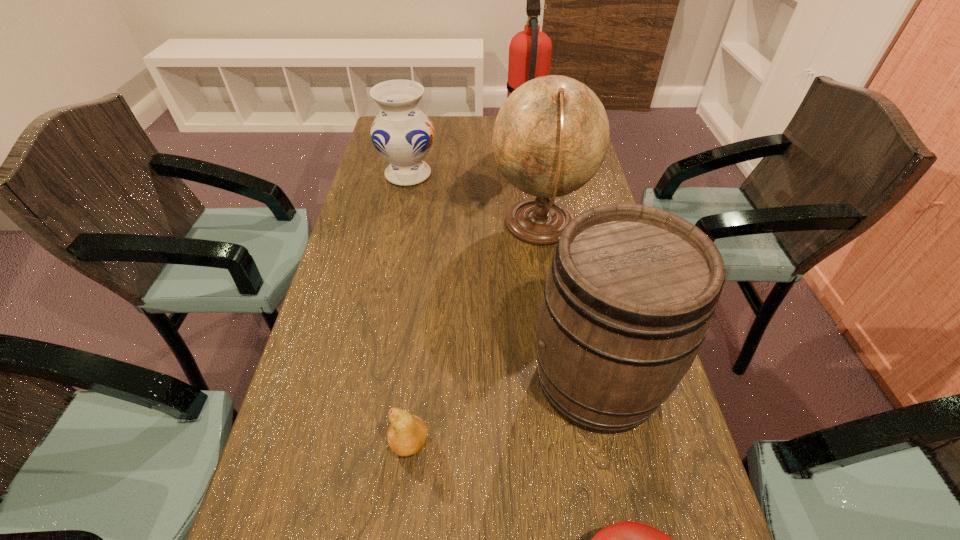
Identify the location of vacant position located 0.390m on the front-facing side of the fourth nearest object. The image size is (960, 540). (353, 226).

Image resolution: width=960 pixels, height=540 pixels. Identify the location of vacant space located 0.110m on the back of the third tallest object. (578, 290).

I want to click on vacant area situated on the right of the fourth tallest object, so 463,174.

The height and width of the screenshot is (540, 960). Find the location of `vacant space located 0.190m on the left of the pear`. vacant space located 0.190m on the left of the pear is located at coordinates (287, 443).

At what (x,y) coordinates should I click in order to perform the action: click on object situated at the far edge. Please return your answer as a coordinate pair (x, y). The width and height of the screenshot is (960, 540). Looking at the image, I should click on (530, 50).

Locate an element on the screen. The width and height of the screenshot is (960, 540). object located at the left edge is located at coordinates (403, 135).

Locate an element on the screen. The height and width of the screenshot is (540, 960). fire extinguisher positioned at the right edge is located at coordinates (530, 50).

What are the coordinates of `globe located in the right edge section of the desktop` in the screenshot? It's located at (550, 137).

The image size is (960, 540). I want to click on wine bucket that is at the right edge, so click(x=628, y=300).

At what (x,y) coordinates should I click in order to perform the action: click on object located in the far right corner section of the desktop. Please return your answer as a coordinate pair (x, y). The image size is (960, 540). Looking at the image, I should click on (530, 50).